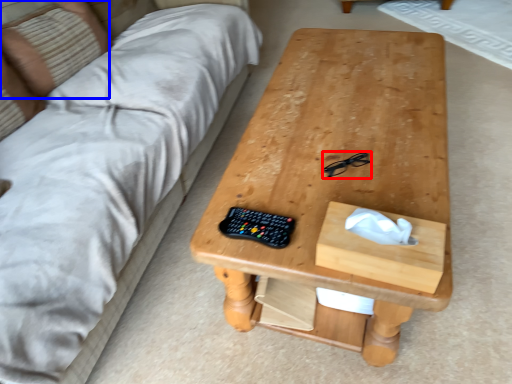
Question: Which object appears farthest to the camera in this image, glasses (highlighted by a red box) or pillow (highlighted by a blue box)?

Choices:
 (A) glasses
 (B) pillow

Answer: (B)